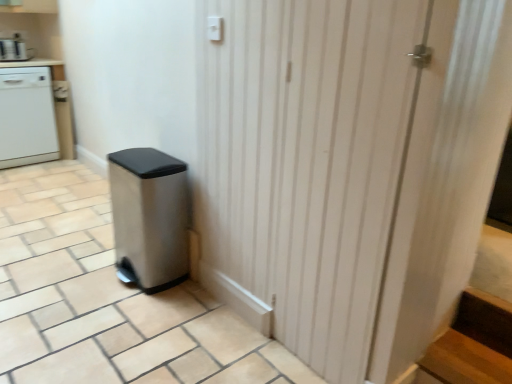
At what (x,y) coordinates should I click in order to perform the action: click on white wood screen door at center. Please return your answer as a coordinate pair (x, y). The image size is (512, 384). Looking at the image, I should click on (305, 164).

Where is `brushed metal coffee maker at upper left`? The height and width of the screenshot is (384, 512). brushed metal coffee maker at upper left is located at coordinates (15, 49).

What do you see at coordinates (15, 49) in the screenshot? I see `brushed metal coffee maker at upper left` at bounding box center [15, 49].

Based on the photo, measure the distance between point (x=168, y=244) and camera.

The depth of point (x=168, y=244) is 2.13 meters.

Where is `white wood screen door at center`? This screenshot has height=384, width=512. white wood screen door at center is located at coordinates (305, 164).

The height and width of the screenshot is (384, 512). In order to click on tile in front of the white glossy dishwasher at left in this screenshot , I will do `click(106, 300)`.

Is white glossy dishwasher at left far from satin silver trash can at lower left?

white glossy dishwasher at left is far away from satin silver trash can at lower left.

From the image's perspective, does white glossy dishwasher at left appear higher than satin silver trash can at lower left?

Yes, from the image's perspective, white glossy dishwasher at left is above satin silver trash can at lower left.

Can you confirm if white glossy dishwasher at left is smaller than satin silver trash can at lower left?

Incorrect, white glossy dishwasher at left is not smaller in size than satin silver trash can at lower left.

Does point (104, 281) come closer to viewer compared to point (138, 190)?

That is False.

From the image's perspective, which one is positioned higher, satin silver trash can at lower left or stainless steel trash can at lower left?

From the image's view, stainless steel trash can at lower left is above.

Which object is further away from the camera taking this photo, satin silver trash can at lower left or stainless steel trash can at lower left?

stainless steel trash can at lower left.

Identify the location of waste container above the satin silver trash can at lower left (from the image's perspective). The width and height of the screenshot is (512, 384). (149, 218).

Measure the distance between brushed metal coffee maker at upper left and stainless steel trash can at lower left.

8.50 feet.

From the picture: Does brushed metal coffee maker at upper left touch stainless steel trash can at lower left?

brushed metal coffee maker at upper left and stainless steel trash can at lower left are not in contact.

Which of these two, brushed metal coffee maker at upper left or stainless steel trash can at lower left, stands taller?

Standing taller between the two is stainless steel trash can at lower left.

Is brushed metal coffee maker at upper left aimed at stainless steel trash can at lower left?

Yes, brushed metal coffee maker at upper left is turned towards stainless steel trash can at lower left.

Considering the relative positions of white glossy dishwasher at left and brushed metal coffee maker at upper left in the image provided, is white glossy dishwasher at left to the left of brushed metal coffee maker at upper left from the viewer's perspective?

No.

Considering the positions of objects white glossy dishwasher at left and brushed metal coffee maker at upper left in the image provided, who is in front, white glossy dishwasher at left or brushed metal coffee maker at upper left?

white glossy dishwasher at left is in front.

From the image's perspective, is white glossy dishwasher at left beneath brushed metal coffee maker at upper left?

Correct, white glossy dishwasher at left appears lower than brushed metal coffee maker at upper left in the image.

Is point (53, 111) farther from camera compared to point (177, 171)?

Yes, point (53, 111) is farther from viewer.

At what (x,y) coordinates should I click in order to perform the action: click on waste container on the right of white glossy dishwasher at left. Please return your answer as a coordinate pair (x, y). This screenshot has height=384, width=512. Looking at the image, I should click on (149, 218).

Is white glossy dishwasher at left positioned far away from stainless steel trash can at lower left?

Absolutely, white glossy dishwasher at left is distant from stainless steel trash can at lower left.

Looking at their sizes, would you say white glossy dishwasher at left is wider or thinner than stainless steel trash can at lower left?

white glossy dishwasher at left is wider than stainless steel trash can at lower left.

Is stainless steel trash can at lower left next to white wood screen door at center and touching it?

stainless steel trash can at lower left is not next to white wood screen door at center, and they're not touching.

Considering the positions of objects stainless steel trash can at lower left and white wood screen door at center in the image provided, who is behind, stainless steel trash can at lower left or white wood screen door at center?

stainless steel trash can at lower left.

Could you tell me if stainless steel trash can at lower left is turned towards white wood screen door at center?

No, stainless steel trash can at lower left does not turn towards white wood screen door at center.

Does stainless steel trash can at lower left have a larger size compared to white wood screen door at center?

Correct, stainless steel trash can at lower left is larger in size than white wood screen door at center.

Considering the sizes of objects stainless steel trash can at lower left and brushed metal coffee maker at upper left in the image provided, who is bigger, stainless steel trash can at lower left or brushed metal coffee maker at upper left?

Bigger between the two is stainless steel trash can at lower left.

How many degrees apart are the facing directions of stainless steel trash can at lower left and brushed metal coffee maker at upper left?

83 degrees.

Is stainless steel trash can at lower left thinner than brushed metal coffee maker at upper left?

Correct, the width of stainless steel trash can at lower left is less than that of brushed metal coffee maker at upper left.

Where is `home appliance behind the satin silver trash can at lower left`? The height and width of the screenshot is (384, 512). home appliance behind the satin silver trash can at lower left is located at coordinates (27, 117).

You are a GUI agent. You are given a task and a screenshot of the screen. Output one action in this format:
    pyautogui.click(x=<x>, y=<y>)
    Task: Click on the waste container on the right of the satin silver trash can at lower left
    
    Given the screenshot: What is the action you would take?
    pyautogui.click(x=149, y=218)

Looking at the image, which one is located closer to brushed metal coffee maker at upper left, satin silver trash can at lower left or white glossy dishwasher at left?

white glossy dishwasher at left lies closer to brushed metal coffee maker at upper left than the other object.

Looking at this image, considering their positions, is white glossy dishwasher at left positioned closer to stainless steel trash can at lower left than satin silver trash can at lower left?

satin silver trash can at lower left lies closer to stainless steel trash can at lower left than the other object.

When comparing their distances from white wood screen door at center, does stainless steel trash can at lower left or satin silver trash can at lower left seem closer?

stainless steel trash can at lower left is closer to white wood screen door at center.

Looking at the image, which one is located further to white glossy dishwasher at left, white wood screen door at center or brushed metal coffee maker at upper left?

white wood screen door at center lies further to white glossy dishwasher at left than the other object.

Based on the photo, from the image, which object appears to be farther from brushed metal coffee maker at upper left, satin silver trash can at lower left or white wood screen door at center?

Based on the image, white wood screen door at center appears to be further to brushed metal coffee maker at upper left.

Consider the image. Estimate the real-world distances between objects in this image. Which object is further from brushed metal coffee maker at upper left, white glossy dishwasher at left or stainless steel trash can at lower left?

stainless steel trash can at lower left is positioned further to the anchor brushed metal coffee maker at upper left.

From the picture: When comparing their distances from satin silver trash can at lower left, does brushed metal coffee maker at upper left or stainless steel trash can at lower left seem further?

Among the two, brushed metal coffee maker at upper left is located further to satin silver trash can at lower left.

Based on their spatial positions, is white wood screen door at center or satin silver trash can at lower left closer to stainless steel trash can at lower left?

Based on the image, satin silver trash can at lower left appears to be nearer to stainless steel trash can at lower left.

At what (x,y) coordinates should I click in order to perform the action: click on home appliance between white wood screen door at center and brushed metal coffee maker at upper left from front to back. Please return your answer as a coordinate pair (x, y). The width and height of the screenshot is (512, 384). Looking at the image, I should click on (27, 117).

The height and width of the screenshot is (384, 512). Identify the location of waste container between white wood screen door at center and white glossy dishwasher at left along the z-axis. (149, 218).

Where is `home appliance positioned between satin silver trash can at lower left and brushed metal coffee maker at upper left from near to far`? home appliance positioned between satin silver trash can at lower left and brushed metal coffee maker at upper left from near to far is located at coordinates (27, 117).

This screenshot has height=384, width=512. Identify the location of screen door between satin silver trash can at lower left and brushed metal coffee maker at upper left along the z-axis. (305, 164).